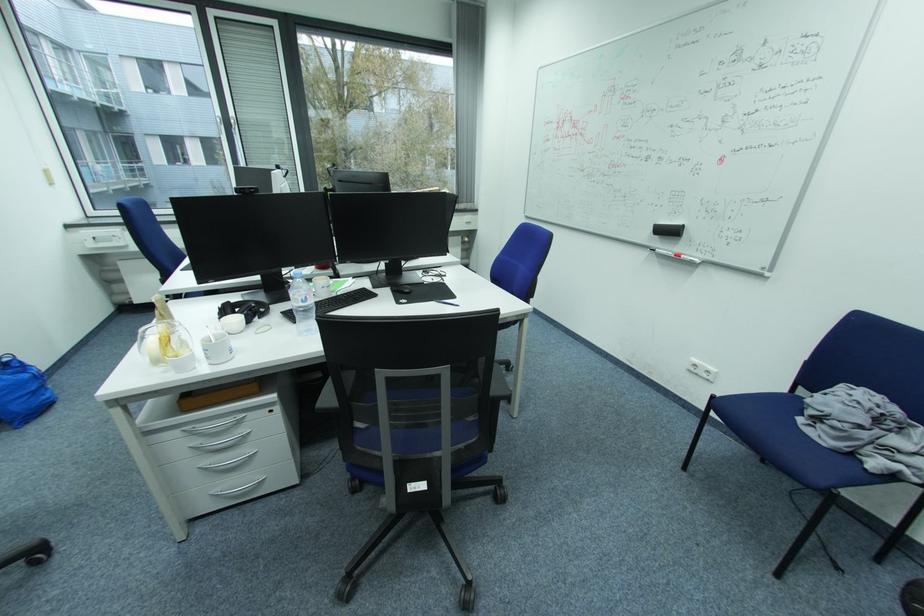
Where is `blue chair sitting surface`? This screenshot has width=924, height=616. blue chair sitting surface is located at coordinates pos(772,428).